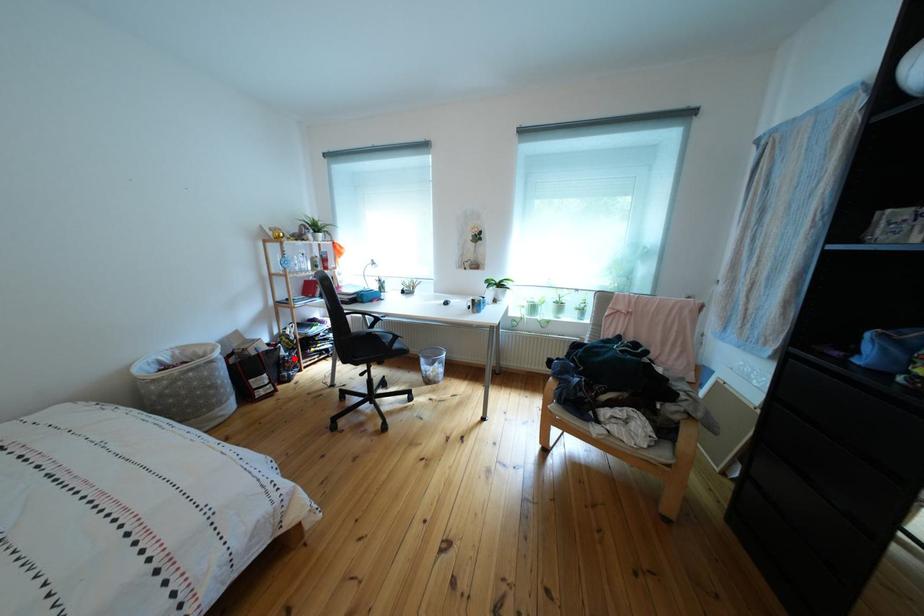
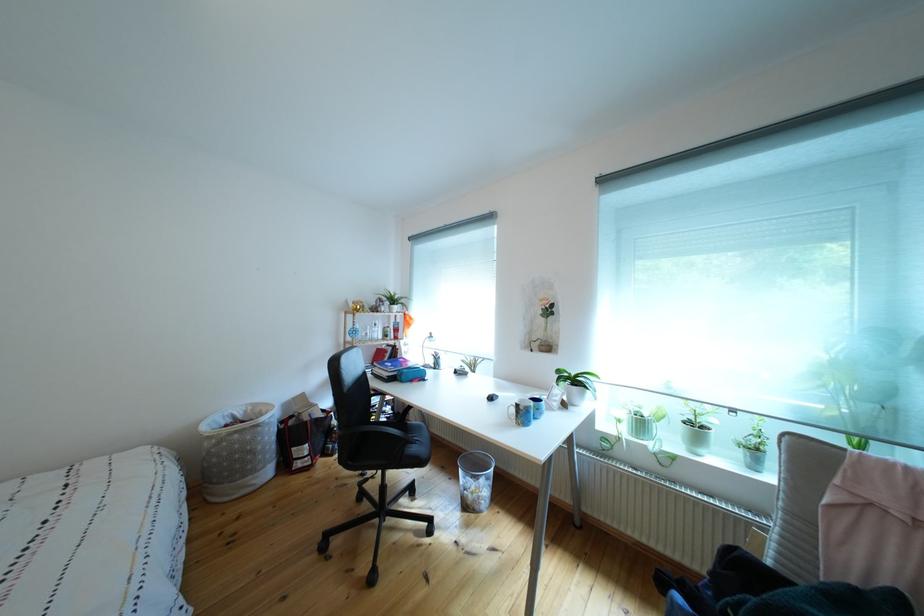
Question: I am providing you with two images of the same scene from different viewpoints. In image1, a red point is highlighted. Considering the same 3D point in image2, which of the following is correct?

Choices:
 (A) It is closer
 (B) It is farther

Answer: (B)